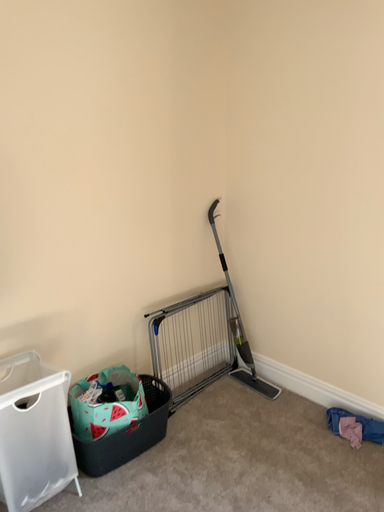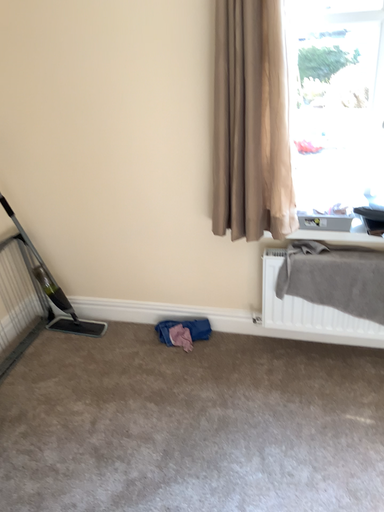
Question: Which way did the camera rotate in the video?

Choices:
 (A) rotated left
 (B) rotated right

Answer: (B)